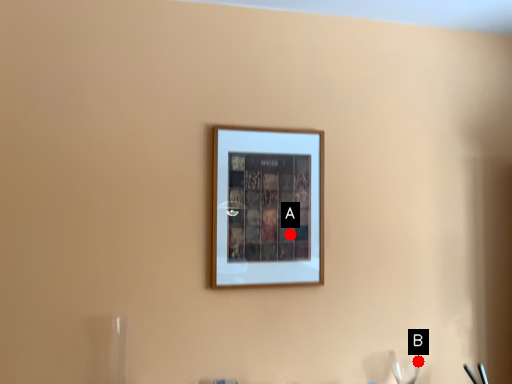
Question: Two points are circled on the image, labeled by A and B beside each circle. Which point is farther to the camera?

Choices:
 (A) A is further
 (B) B is further

Answer: (B)